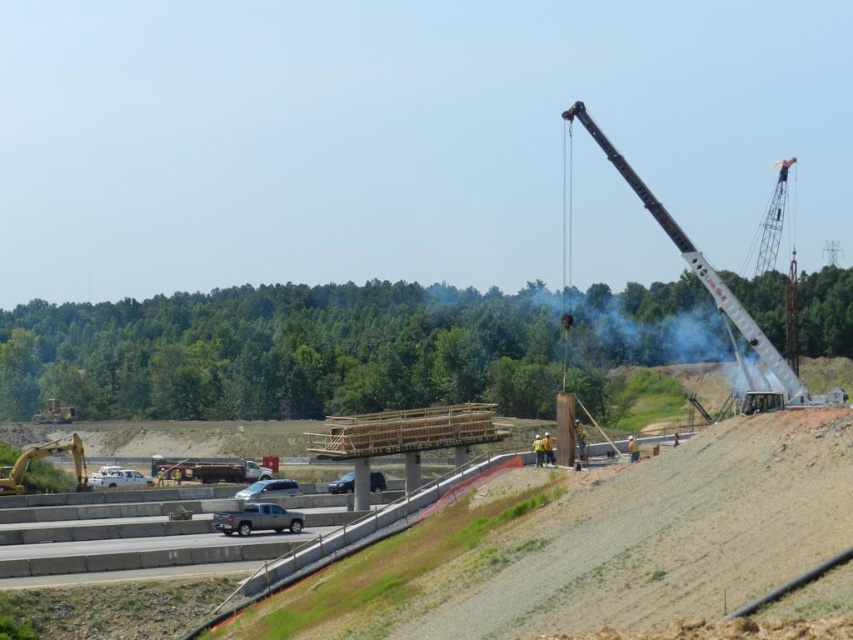
You are a delivery driver who needs to park your vehicle in this construction site. You have a truck that is 2 meters wide. You see the white matte van at lower left and the satin black suv at center. Which vehicle has enough space to park next to without overlapping?

The white matte van at lower left has a larger width than the satin black suv at center, so it can accommodate the 2 meter wide truck with more space available.

You are a delivery driver arriving at the construction site. You need to park your vehicle between the white matte van at lower left and the silver metallic car at center. Which vehicle should you park closer to if you want to avoid blocking the crane operator? Please explain your reasoning.

The white matte van at lower left is taller than the silver metallic car at center. To avoid blocking the crane operator, you should park closer to the silver metallic car at center since it is shorter, providing a clearer line of sight for the crane operations.

You are a delivery driver who needs to park your vehicle in the construction site. You have a white matte van at lower left and a satin black suv at center. The construction supervisor requires that all vehicles must be parked at least 20 meters away from each other for safety. Can you park your vehicle in the current position?

The distance between the white matte van at lower left and the satin black suv at center is 16.73 meters, which is less than the required 20 meters. Therefore, you cannot park your vehicle in the current position as it violates the safety distance requirement.